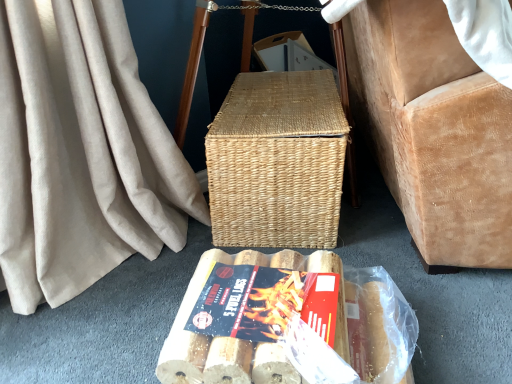
The height and width of the screenshot is (384, 512). I want to click on vacant area that lies to the right of wooden logs at lower center, so 447,316.